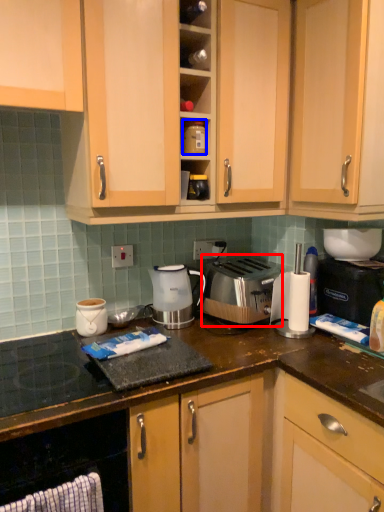
Question: Which point is closer to the camera, toaster (highlighted by a red box) or appliance (highlighted by a blue box)?

Choices:
 (A) toaster
 (B) appliance

Answer: (B)